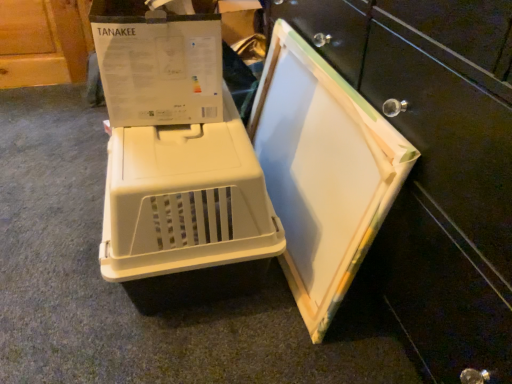
The height and width of the screenshot is (384, 512). In order to click on free spot to the left of beige plastic crate at center in this screenshot , I will do pos(62,239).